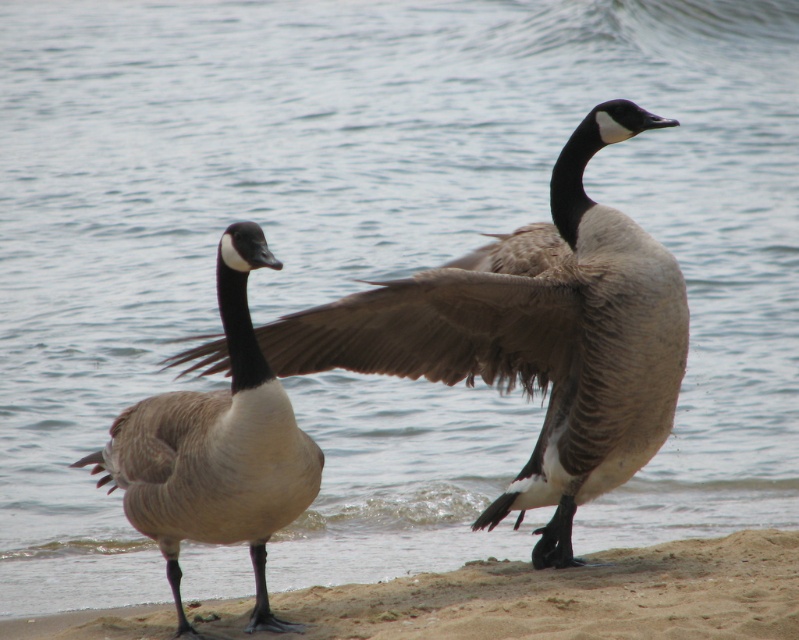
Does point (334, 609) lie in front of point (195, 472)?

No, (334, 609) is further to viewer.

Based on the photo, who is more forward, (589, 592) or (90, 456)?

Point (90, 456) is in front.

You are a GUI agent. You are given a task and a screenshot of the screen. Output one action in this format:
    pyautogui.click(x=<x>, y=<y>)
    Task: Click on the sandy brown at lower center
    This screenshot has height=640, width=799.
    Given the screenshot: What is the action you would take?
    pyautogui.click(x=559, y=596)

Between brown feathered goose at center and matte brown duck at left, which one appears on the left side from the viewer's perspective?

From the viewer's perspective, matte brown duck at left appears more on the left side.

Is brown feathered goose at center thinner than matte brown duck at left?

In fact, brown feathered goose at center might be wider than matte brown duck at left.

This screenshot has height=640, width=799. Identify the location of brown feathered goose at center. (533, 336).

This screenshot has height=640, width=799. Find the location of `brown feathered goose at center`. brown feathered goose at center is located at coordinates (533, 336).

Based on the photo, does brown feathered goose at center appear on the right side of sandy brown at lower center?

Indeed, brown feathered goose at center is positioned on the right side of sandy brown at lower center.

What do you see at coordinates (533, 336) in the screenshot?
I see `brown feathered goose at center` at bounding box center [533, 336].

Is point (479, 273) positioned behind point (350, 608)?

That is True.

Image resolution: width=799 pixels, height=640 pixels. Identify the location of brown feathered goose at center. (533, 336).